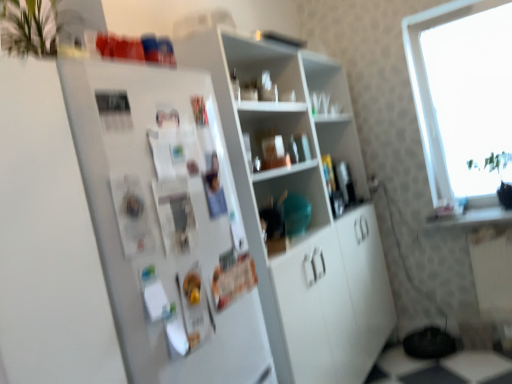
Locate an element on the screen. This screenshot has height=384, width=512. matte plastic bowl at center, which appears as the 2th shelf when ordered from the bottom is located at coordinates (289, 197).

What do you see at coordinates (461, 92) in the screenshot? Image resolution: width=512 pixels, height=384 pixels. I see `transparent glass window at upper right` at bounding box center [461, 92].

Measure the distance between white matte refrigerator at left and camera.

white matte refrigerator at left is 38.94 inches from camera.

Find the location of a particular element. matte plastic bottles at center, the 1th shelf positioned from the top is located at coordinates (343, 154).

Does point (272, 211) come in front of point (268, 309)?

No.

From the image's perspective, which is above, matte plastic bowl at center, which appears as the 2th shelf when ordered from the bottom, or white glossy cabinet at center, the first shelf ordered from the bottom?

From the image's view, matte plastic bowl at center, which appears as the 2th shelf when ordered from the bottom, is above.

Looking at this image, is matte plastic bowl at center, which appears as the 2th shelf when ordered from the bottom, not close to white glossy cabinet at center, the first shelf ordered from the bottom?

matte plastic bowl at center, which appears as the 2th shelf when ordered from the bottom, is near white glossy cabinet at center, the first shelf ordered from the bottom, not far away.

From a real-world perspective, is matte plastic bowl at center, which is the 2th shelf in top-to-bottom order, above or below white glossy cabinet at center, which appears as the third shelf when viewed from the top?

Clearly, from a real-world perspective, matte plastic bowl at center, which is the 2th shelf in top-to-bottom order, is above white glossy cabinet at center, which appears as the third shelf when viewed from the top.

Image resolution: width=512 pixels, height=384 pixels. Identify the location of fridge in front of the matte plastic bowl at center, which appears as the 2th shelf when ordered from the bottom. (167, 223).

From the image's perspective, which is above, white matte refrigerator at left or matte plastic bowl at center, which is the 2th shelf in top-to-bottom order?

matte plastic bowl at center, which is the 2th shelf in top-to-bottom order, appears higher in the image.

In terms of width, does white matte refrigerator at left look wider or thinner when compared to matte plastic bowl at center, which is the 2th shelf in top-to-bottom order?

Clearly, white matte refrigerator at left has more width compared to matte plastic bowl at center, which is the 2th shelf in top-to-bottom order.

Between point (221, 234) and point (248, 224), which one is positioned behind?

The point (248, 224) is behind.

Is matte plastic bowl at center, which is the 2th shelf in top-to-bottom order, directly adjacent to transparent glass window at upper right?

No.

Considering the positions of objects matte plastic bowl at center, which appears as the 2th shelf when ordered from the bottom, and transparent glass window at upper right in the image provided, who is more to the left, matte plastic bowl at center, which appears as the 2th shelf when ordered from the bottom, or transparent glass window at upper right?

From the viewer's perspective, matte plastic bowl at center, which appears as the 2th shelf when ordered from the bottom, appears more on the left side.

Is matte plastic bowl at center, which is the 2th shelf in top-to-bottom order, closer to camera compared to transparent glass window at upper right?

Yes, matte plastic bowl at center, which is the 2th shelf in top-to-bottom order, is in front of transparent glass window at upper right.

At what (x,y) coordinates should I click in order to perform the action: click on shelf behind the transparent glass window at upper right. Please return your answer as a coordinate pair (x, y). This screenshot has width=512, height=384. Looking at the image, I should click on (343, 154).

From the image's perspective, would you say transparent glass window at upper right is positioned over matte plastic bottles at center, arranged as the third shelf when ordered from the bottom?

Indeed, from the image's perspective, transparent glass window at upper right is shown above matte plastic bottles at center, arranged as the third shelf when ordered from the bottom.

Is transparent glass window at upper right smaller than matte plastic bottles at center, arranged as the third shelf when ordered from the bottom?

Actually, transparent glass window at upper right might be larger than matte plastic bottles at center, arranged as the third shelf when ordered from the bottom.

From a real-world perspective, which is physically below, transparent glass window at upper right or matte plastic bottles at center, the 1th shelf positioned from the top?

matte plastic bottles at center, the 1th shelf positioned from the top, is physically lower.

Can white matte refrigerator at left be found inside matte plastic bottles at center, arranged as the third shelf when ordered from the bottom?

No, matte plastic bottles at center, arranged as the third shelf when ordered from the bottom, does not contain white matte refrigerator at left.

Where is `the 3rd shelf positioned above the white matte refrigerator at left (from the image's perspective)`? The height and width of the screenshot is (384, 512). the 3rd shelf positioned above the white matte refrigerator at left (from the image's perspective) is located at coordinates (343, 154).

From the image's perspective, relative to white matte refrigerator at left, is matte plastic bottles at center, arranged as the third shelf when ordered from the bottom, above or below?

matte plastic bottles at center, arranged as the third shelf when ordered from the bottom, is above white matte refrigerator at left.

Which object is thinner, matte plastic bottles at center, the 1th shelf positioned from the top, or white matte refrigerator at left?

matte plastic bottles at center, the 1th shelf positioned from the top, is thinner.

Considering the sizes of objects matte plastic bottles at center, arranged as the third shelf when ordered from the bottom, and white glossy cabinet at center, the first shelf ordered from the bottom, in the image provided, who is bigger, matte plastic bottles at center, arranged as the third shelf when ordered from the bottom, or white glossy cabinet at center, the first shelf ordered from the bottom,?

Bigger between the two is white glossy cabinet at center, the first shelf ordered from the bottom.

Based on the photo, from a real-world perspective, is matte plastic bottles at center, arranged as the third shelf when ordered from the bottom, above or below white glossy cabinet at center, which appears as the third shelf when viewed from the top?

In terms of real-world spatial position, matte plastic bottles at center, arranged as the third shelf when ordered from the bottom, is above white glossy cabinet at center, which appears as the third shelf when viewed from the top.

From the picture: Is matte plastic bottles at center, the 1th shelf positioned from the top, not within white glossy cabinet at center, which appears as the third shelf when viewed from the top?

Actually, matte plastic bottles at center, the 1th shelf positioned from the top, is within white glossy cabinet at center, which appears as the third shelf when viewed from the top.

Looking at this image, is matte plastic bottles at center, arranged as the third shelf when ordered from the bottom, oriented away from transparent glass window at upper right?

No, transparent glass window at upper right is not at the back of matte plastic bottles at center, arranged as the third shelf when ordered from the bottom.

Can you confirm if matte plastic bottles at center, arranged as the third shelf when ordered from the bottom, is wider than transparent glass window at upper right?

No, matte plastic bottles at center, arranged as the third shelf when ordered from the bottom, is not wider than transparent glass window at upper right.

How different are the orientations of matte plastic bottles at center, the 1th shelf positioned from the top, and transparent glass window at upper right in degrees?

The angular difference between matte plastic bottles at center, the 1th shelf positioned from the top, and transparent glass window at upper right is 90.7 degrees.

Locate an element on the screen. the 1st shelf behind the white glossy cabinet at center, which appears as the third shelf when viewed from the top, starting your count from the anchor is located at coordinates (289, 197).

From the image's perspective, starting from the white matte refrigerator at left, which shelf is the 2nd one above? Please provide its 2D coordinates.

[(289, 197)]

Based on the photo, considering their positions, is transparent glass window at upper right positioned closer to white matte refrigerator at left than matte plastic bottles at center, arranged as the third shelf when ordered from the bottom?

Based on the image, matte plastic bottles at center, arranged as the third shelf when ordered from the bottom, appears to be nearer to white matte refrigerator at left.

Considering their positions, is transparent glass window at upper right positioned closer to white matte refrigerator at left than white glossy cabinet at center, the first shelf ordered from the bottom?

white glossy cabinet at center, the first shelf ordered from the bottom, is closer to white matte refrigerator at left.

Estimate the real-world distances between objects in this image. Which object is further from white matte refrigerator at left, white glossy cabinet at center, the first shelf ordered from the bottom, or matte plastic bottles at center, arranged as the third shelf when ordered from the bottom?

matte plastic bottles at center, arranged as the third shelf when ordered from the bottom, lies further to white matte refrigerator at left than the other object.

Considering their positions, is white matte refrigerator at left positioned closer to matte plastic bowl at center, which is the 2th shelf in top-to-bottom order, than white glossy cabinet at center, the first shelf ordered from the bottom?

The object closer to matte plastic bowl at center, which is the 2th shelf in top-to-bottom order, is white glossy cabinet at center, the first shelf ordered from the bottom.

Consider the image. Looking at the image, which one is located closer to white matte refrigerator at left, matte plastic bottles at center, the 1th shelf positioned from the top, or matte plastic bowl at center, which is the 2th shelf in top-to-bottom order?

The object closer to white matte refrigerator at left is matte plastic bowl at center, which is the 2th shelf in top-to-bottom order.

Considering their positions, is matte plastic bowl at center, which appears as the 2th shelf when ordered from the bottom, positioned further to transparent glass window at upper right than white matte refrigerator at left?

Based on the image, white matte refrigerator at left appears to be further to transparent glass window at upper right.

Based on their spatial positions, is white glossy cabinet at center, which appears as the third shelf when viewed from the top, or transparent glass window at upper right closer to white matte refrigerator at left?

white glossy cabinet at center, which appears as the third shelf when viewed from the top, lies closer to white matte refrigerator at left than the other object.

Based on their spatial positions, is white matte refrigerator at left or transparent glass window at upper right closer to white glossy cabinet at center, which appears as the third shelf when viewed from the top?

white matte refrigerator at left is positioned closer to the anchor white glossy cabinet at center, which appears as the third shelf when viewed from the top.

Locate an element on the screen. The image size is (512, 384). shelf between white glossy cabinet at center, which appears as the third shelf when viewed from the top, and transparent glass window at upper right from left to right is located at coordinates (343, 154).

Find the location of a particular element. This screenshot has width=512, height=384. shelf between white glossy cabinet at center, which appears as the third shelf when viewed from the top, and matte plastic bottles at center, arranged as the third shelf when ordered from the bottom, in the front-back direction is located at coordinates (289, 197).

Locate an element on the screen. window between white matte refrigerator at left and matte plastic bottles at center, the 1th shelf positioned from the top, from front to back is located at coordinates (461, 92).

Locate an element on the screen. Image resolution: width=512 pixels, height=384 pixels. shelf between white matte refrigerator at left and matte plastic bowl at center, which is the 2th shelf in top-to-bottom order, in the front-back direction is located at coordinates (311, 213).